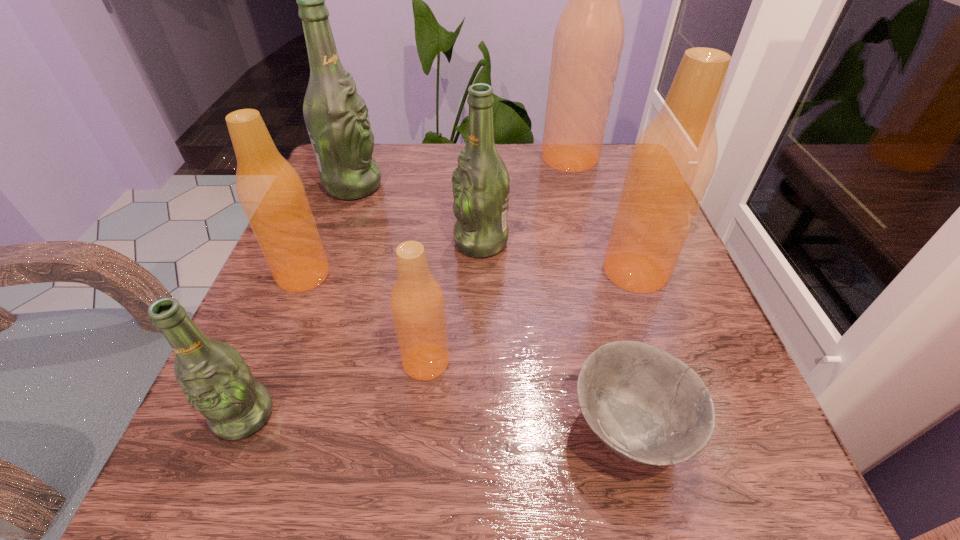
Image resolution: width=960 pixels, height=540 pixels. What are the coordinates of `tan beer bottle object that ranks as the closest to the rightmost green beer bottle` in the screenshot? It's located at (673, 161).

Locate an element on the screen. This screenshot has width=960, height=540. the third closest green beer bottle to the second nearest beer bottle is located at coordinates (336, 116).

Select which green beer bottle appears as the second closest to the bowl. Please provide its 2D coordinates. Your answer should be formatted as a tuple, i.e. [(x, y)], where the tuple contains the x and y coordinates of a point satisfying the conditions above.

[(216, 381)]

The width and height of the screenshot is (960, 540). Identify the location of vacant space that satisfies the following two spatial constraints: 1. on the back side of the shortest object; 2. on the surface of the second smallest green beer bottle. (582, 242).

Find the location of a particular element. vacant space that satisfies the following two spatial constraints: 1. on the back side of the sixth farthest beer bottle; 2. on the surface of the farthest green beer bottle is located at coordinates (x=444, y=186).